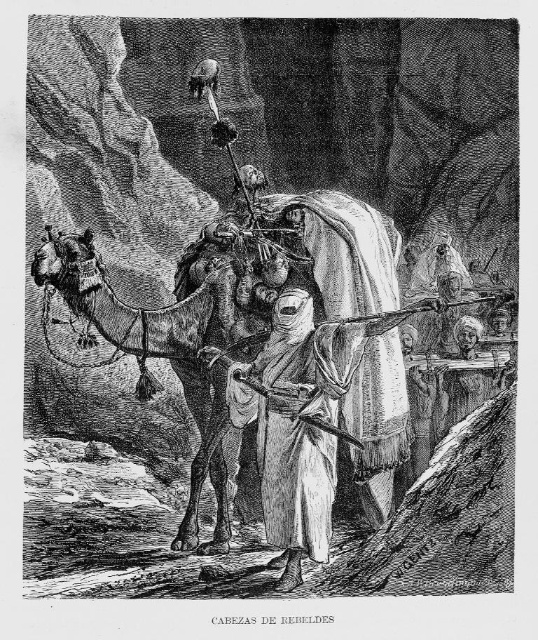
In the engraving titled Cabezas de Rebeldes, there is a point labeled at coordinates (178, 342). Which object from the scene does this point correspond to?

The point at coordinates (178, 342) corresponds to the brown textured camel at center.

You are an observer looking at the engraving. The scene shows a brown textured camel at center and a white clothed figure at center. Which object is placed higher in the image?

The brown textured camel at center is positioned over the white clothed figure at center, so it is higher in the image.